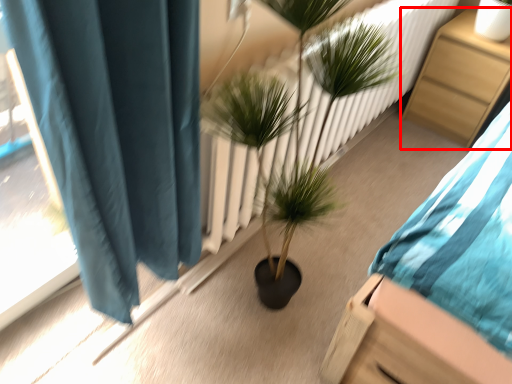
Question: From the image's perspective, what is the correct spatial positioning of furniture (annotated by the red box) in reference to houseplant?

Choices:
 (A) above
 (B) below

Answer: (A)